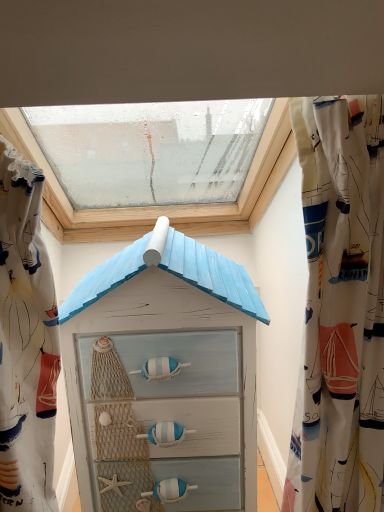
Question: Considering the positions of point (33, 415) and point (347, 324), is point (33, 415) closer or farther from the camera than point (347, 324)?

Choices:
 (A) farther
 (B) closer

Answer: (A)

Question: In terms of width, does white sailboat-patterned fabric at upper left, positioned as the first curtain in left-to-right order, look wider or thinner when compared to white fabric with nautical prints at right, placed as the first curtain when sorted from right to left?

Choices:
 (A) thin
 (B) wide

Answer: (B)

Question: Which object is the closest to the white sailboat-patterned fabric at upper left, the 2th curtain when ordered from right to left?

Choices:
 (A) light blue painted wood at center
 (B) transparent glass window at upper center
 (C) white fabric with nautical prints at right, the second curtain positioned from the left

Answer: (A)

Question: Which object is the closest to the transparent glass window at upper center?

Choices:
 (A) light blue painted wood at center
 (B) white fabric with nautical prints at right, placed as the first curtain when sorted from right to left
 (C) white sailboat-patterned fabric at upper left, positioned as the first curtain in left-to-right order

Answer: (A)